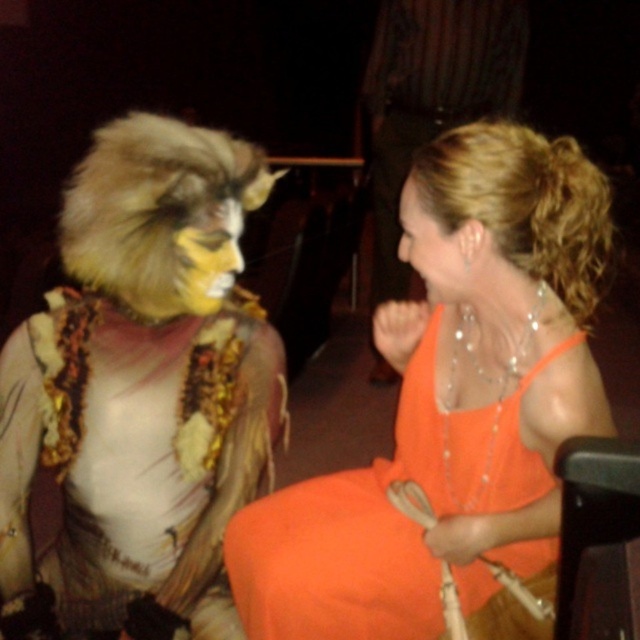
Consider the image. Is furry costume at left taller than orange satin dress at center?

No.

Can you confirm if furry costume at left is positioned below orange satin dress at center?

Indeed, furry costume at left is positioned under orange satin dress at center.

I want to click on furry costume at left, so click(x=141, y=387).

Between point (112, 348) and point (426, 76), which one is positioned behind?

The point (426, 76) is more distant.

Is point (120, 300) closer to viewer compared to point (522, 32)?

That is True.

Locate an element on the screen. This screenshot has width=640, height=640. furry costume at left is located at coordinates (141, 387).

Can you confirm if furry costume at left is positioned below yellow fur face at center?

Indeed, furry costume at left is positioned under yellow fur face at center.

Does furry costume at left appear on the left side of yellow fur face at center?

Correct, you'll find furry costume at left to the left of yellow fur face at center.

I want to click on furry costume at left, so click(x=141, y=387).